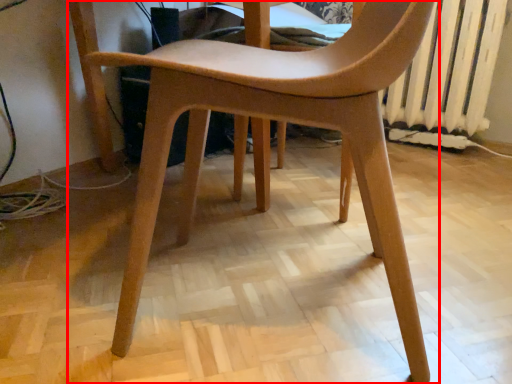
Question: Considering the relative positions of chair (annotated by the red box) and radiator in the image provided, where is chair (annotated by the red box) located with respect to the staircase?

Choices:
 (A) right
 (B) left

Answer: (B)